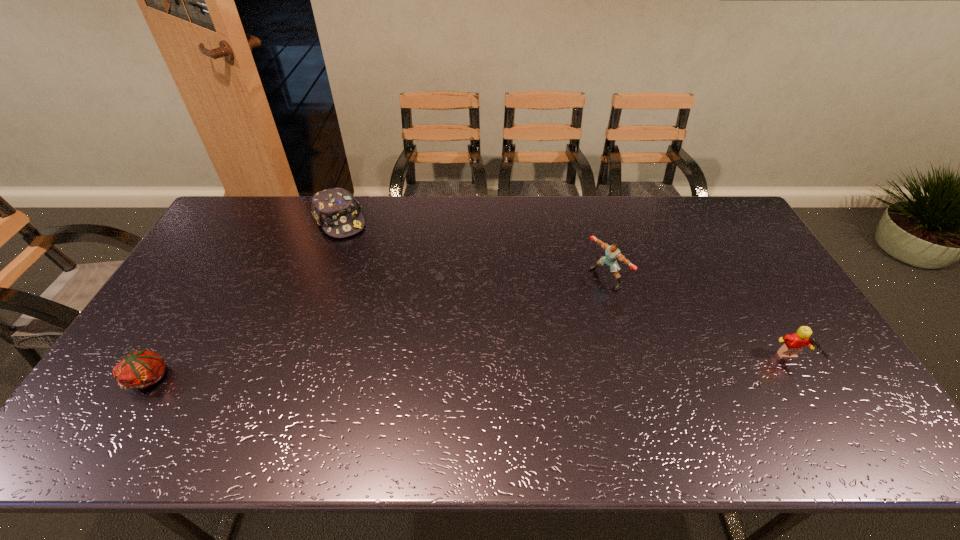
Locate an element on the screen. vacant space that's between the tallest object and the rightmost object is located at coordinates (699, 320).

Where is `vacant region between the rightmost object and the tallest object`? The height and width of the screenshot is (540, 960). vacant region between the rightmost object and the tallest object is located at coordinates (699, 320).

Locate an element on the screen. The width and height of the screenshot is (960, 540). vacant area that lies between the rightmost object and the third nearest object is located at coordinates (699, 320).

Where is `free space between the leftmost object and the headwear`? Image resolution: width=960 pixels, height=540 pixels. free space between the leftmost object and the headwear is located at coordinates (245, 299).

Where is `free point between the second farthest object and the rightmost object`? The width and height of the screenshot is (960, 540). free point between the second farthest object and the rightmost object is located at coordinates (699, 320).

Locate an element on the screen. The image size is (960, 540). object that is the second closest to the second object from left to right is located at coordinates 612,253.

At what (x,y) coordinates should I click in order to perform the action: click on object that ranks as the second closest to the leftmost object. Please return your answer as a coordinate pair (x, y). Looking at the image, I should click on (612, 253).

What are the coordinates of `vacant space that satisfies the following two spatial constraints: 1. on the front side of the farthest object; 2. in front of the rightmost object with the accessory visible` in the screenshot? It's located at (288, 362).